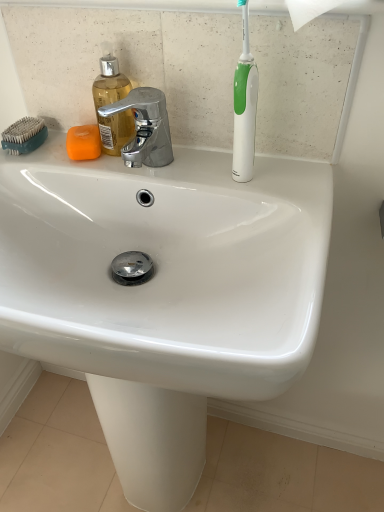
Where is `free region on the left part of white glossy toothbrush at upper right`? free region on the left part of white glossy toothbrush at upper right is located at coordinates (175, 173).